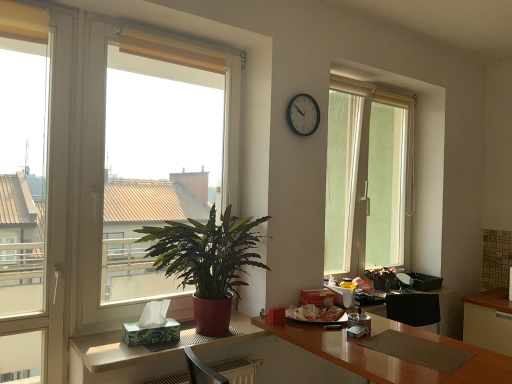
Question: Can you confirm if white glossy cabinet at lower right is wider than white glossy table at lower left?

Choices:
 (A) no
 (B) yes

Answer: (B)

Question: Is white glossy cabinet at lower right at the right side of white glossy table at lower left?

Choices:
 (A) no
 (B) yes

Answer: (B)

Question: Is white glossy cabinet at lower right smaller than white glossy table at lower left?

Choices:
 (A) no
 (B) yes

Answer: (A)

Question: Is white glossy cabinet at lower right touching white glossy table at lower left?

Choices:
 (A) no
 (B) yes

Answer: (A)

Question: From a real-world perspective, is white glossy cabinet at lower right beneath white glossy table at lower left?

Choices:
 (A) no
 (B) yes

Answer: (B)

Question: From a real-world perspective, is green leafy plant at left above or below green leafy plant at center, placed as the 1th houseplant when sorted from right to left?

Choices:
 (A) above
 (B) below

Answer: (A)

Question: In terms of height, does green leafy plant at left look taller or shorter compared to green leafy plant at center, placed as the 1th houseplant when sorted from right to left?

Choices:
 (A) short
 (B) tall

Answer: (B)

Question: From the image's perspective, is green leafy plant at left located above or below green leafy plant at center, which is counted as the second houseplant, starting from the left?

Choices:
 (A) above
 (B) below

Answer: (A)

Question: Visually, is green leafy plant at left positioned to the left or to the right of green leafy plant at center, which is counted as the second houseplant, starting from the left?

Choices:
 (A) right
 (B) left

Answer: (B)

Question: Do you think white glossy table at lower left is within brown glossy desk at center, or outside of it?

Choices:
 (A) outside
 (B) inside

Answer: (A)

Question: Looking at their shapes, would you say white glossy table at lower left is wider or thinner than brown glossy desk at center?

Choices:
 (A) wide
 (B) thin

Answer: (B)

Question: From the image's perspective, is white glossy table at lower left located above or below brown glossy desk at center?

Choices:
 (A) below
 (B) above

Answer: (B)

Question: Is point (226, 342) positioned closer to the camera than point (464, 380)?

Choices:
 (A) farther
 (B) closer

Answer: (A)

Question: Considering the positions of beige fabric curtain at upper center and transparent glass window at center in the image, is beige fabric curtain at upper center bigger or smaller than transparent glass window at center?

Choices:
 (A) big
 (B) small

Answer: (B)

Question: Is beige fabric curtain at upper center wider or thinner than transparent glass window at center?

Choices:
 (A) wide
 (B) thin

Answer: (B)